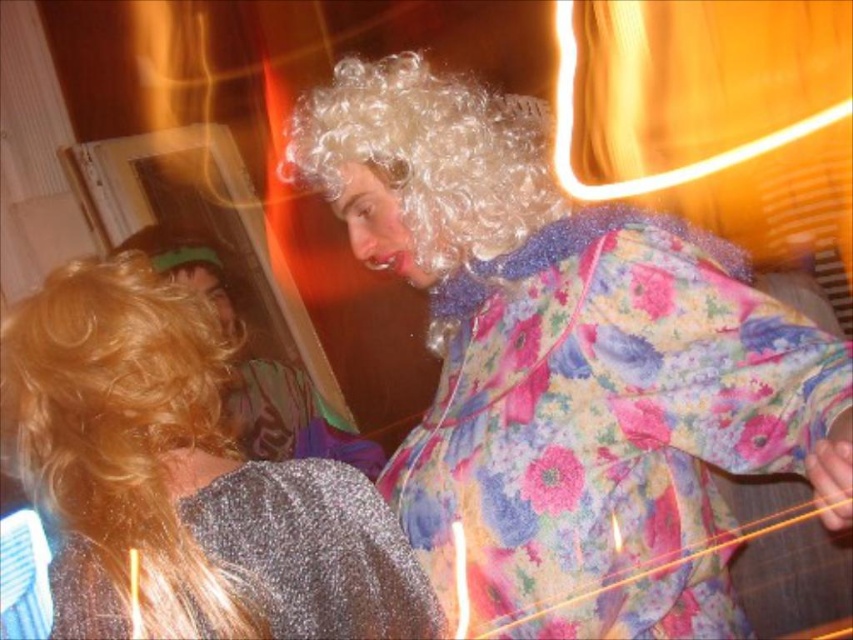
Question: Among these points, which one is farthest from the camera?

Choices:
 (A) (297, 528)
 (B) (206, 620)

Answer: (A)

Question: Is shiny silver dress at lower left further to camera compared to sparkly silver robe at lower left?

Choices:
 (A) no
 (B) yes

Answer: (A)

Question: Where is floral fabric dress at upper right located in relation to sparkly silver robe at lower left in the image?

Choices:
 (A) left
 (B) right

Answer: (B)

Question: Does shiny silver dress at lower left appear under sparkly silver robe at lower left?

Choices:
 (A) no
 (B) yes

Answer: (A)

Question: Which point appears closest to the camera in this image?

Choices:
 (A) (554, 196)
 (B) (131, 353)
 (C) (111, 600)

Answer: (C)

Question: Which point is closer to the camera taking this photo?

Choices:
 (A) (134, 476)
 (B) (674, 630)

Answer: (A)